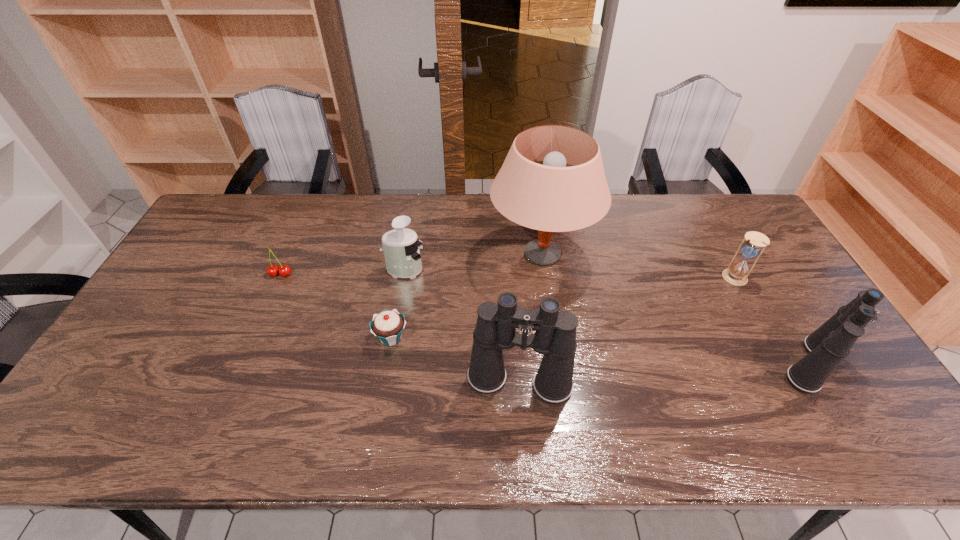
You are a GUI agent. You are given a task and a screenshot of the screen. Output one action in this format:
    pyautogui.click(x=<x>, y=<y>)
    Task: Click on the left binoculars
    The image size is (960, 540).
    Given the screenshot: What is the action you would take?
    pyautogui.click(x=555, y=332)

Find the location of a particular element. This screenshot has height=540, width=960. the taller binoculars is located at coordinates (555, 332).

Where is `the right binoculars`? the right binoculars is located at coordinates (827, 346).

Locate an element on the screen. the fifth shortest object is located at coordinates (827, 346).

The height and width of the screenshot is (540, 960). Find the location of `the leftmost object`. the leftmost object is located at coordinates (273, 270).

You are a GUI agent. You are given a task and a screenshot of the screen. Output one action in this format:
    pyautogui.click(x=<x>, y=<y>)
    Task: Click on the cupcake
    Image resolution: width=960 pixels, height=540 pixels.
    Given the screenshot: What is the action you would take?
    pyautogui.click(x=388, y=326)

This screenshot has height=540, width=960. Identify the location of hourglass. (737, 272).

I want to click on the tallest object, so click(x=551, y=197).

Locate an element on the screen. juicer is located at coordinates (402, 255).

The width and height of the screenshot is (960, 540). I want to click on vacant space located on the left of the second tallest object, so click(355, 382).